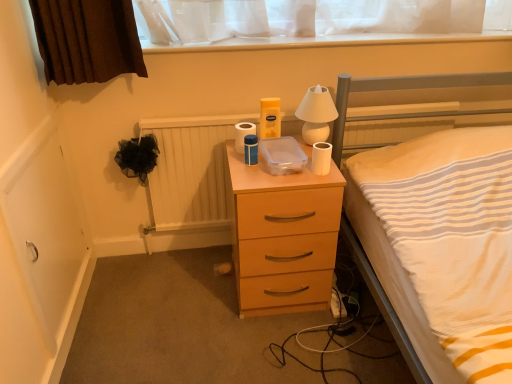
I want to click on vacant space in front of white matte toilet paper at center, which is the 2th toilet paper in front-to-back order, so click(249, 169).